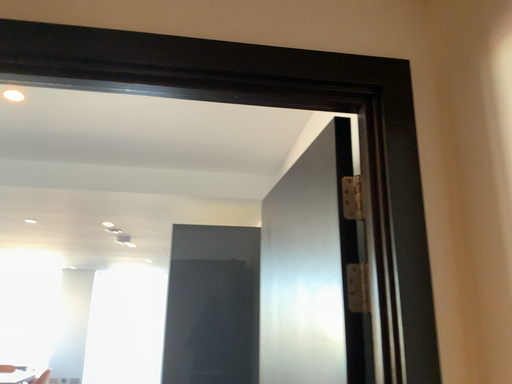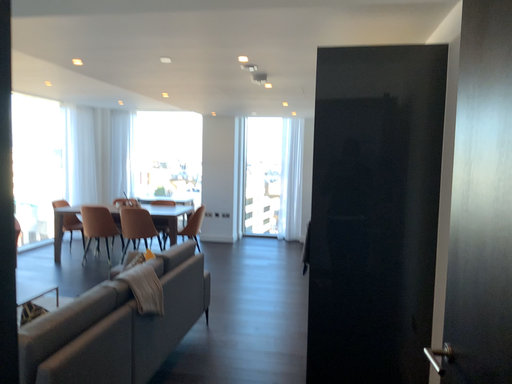
Question: How did the camera likely rotate when shooting the video?

Choices:
 (A) rotated left
 (B) rotated right

Answer: (A)